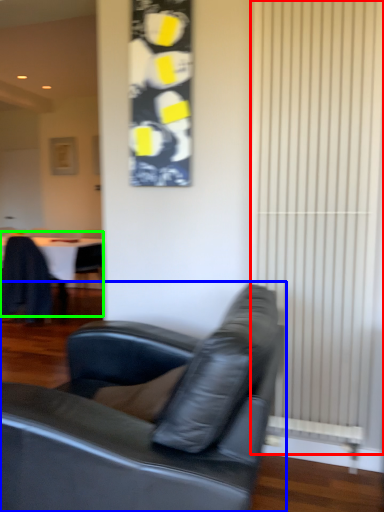
Question: Considering the real-world distances, which object is farthest from curtain (highlighted by a red box)? studio couch (highlighted by a blue box) or table (highlighted by a green box)?

Choices:
 (A) studio couch
 (B) table

Answer: (B)